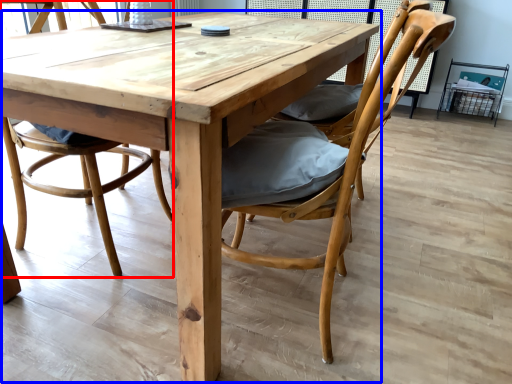
Question: Which of the following is the closest to the observer, chair (highlighted by a red box) or kitchen & dining room table (highlighted by a blue box)?

Choices:
 (A) chair
 (B) kitchen & dining room table

Answer: (B)